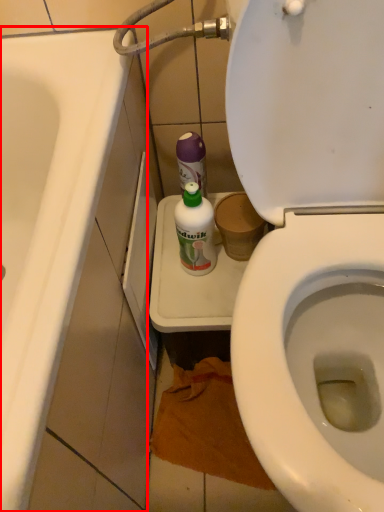
Question: From the image, what is the correct spatial relationship of bath (annotated by the red box) in relation to cleaning product?

Choices:
 (A) right
 (B) left

Answer: (B)